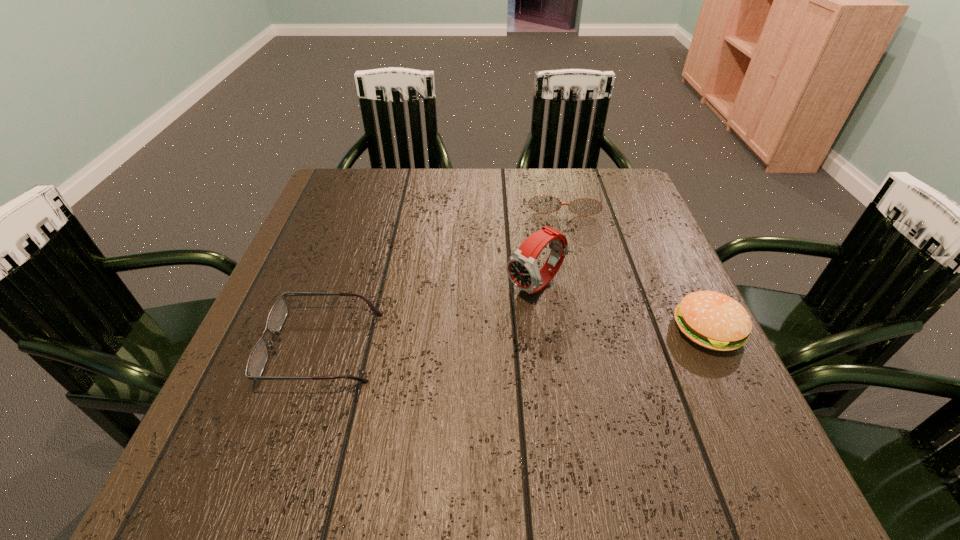
Where is `free space on the desktop that is between the leftmost object and the third shortest object and is positioned on the face of the sunglasses`? free space on the desktop that is between the leftmost object and the third shortest object and is positioned on the face of the sunglasses is located at coordinates (567, 336).

Find the location of a particular element. The width and height of the screenshot is (960, 540). vacant space on the desktop that is between the leftmost object and the patty and is positioned on the face of the watch is located at coordinates (461, 341).